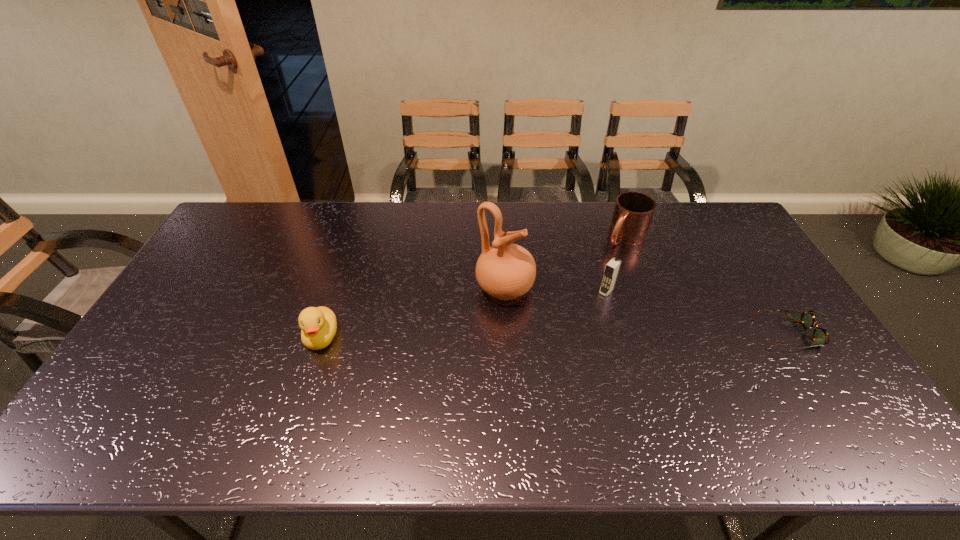
In order to click on duckling in this screenshot , I will do `click(318, 325)`.

The height and width of the screenshot is (540, 960). I want to click on the shortest object, so click(x=821, y=337).

This screenshot has width=960, height=540. Identify the location of the rightmost object. (821, 337).

In order to click on the tallest object in this screenshot , I will do `click(506, 271)`.

Where is `pottery`? Image resolution: width=960 pixels, height=540 pixels. pottery is located at coordinates (506, 271).

You are a GUI agent. You are given a task and a screenshot of the screen. Output one action in this format:
    pyautogui.click(x=<x>, y=<y>)
    Task: Click on the farthest object
    Image resolution: width=960 pixels, height=540 pixels.
    Given the screenshot: What is the action you would take?
    pyautogui.click(x=633, y=211)

The width and height of the screenshot is (960, 540). I want to click on mug, so click(633, 211).

Identify the location of the second tallest object. This screenshot has height=540, width=960. (612, 268).

Locate an element on the screen. the third object from left to right is located at coordinates (612, 268).

This screenshot has width=960, height=540. Identify the location of free spot located on the face of the leftmost object. (300, 403).